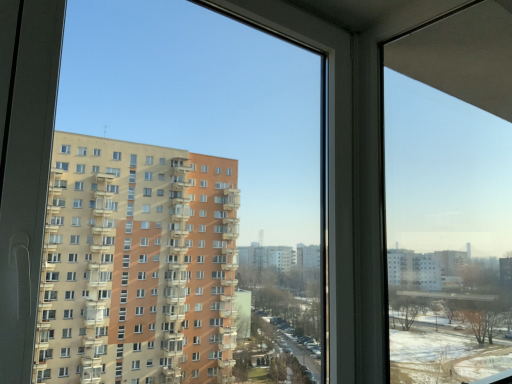
Describe the element at coordinates (450, 197) in the screenshot. Image resolution: width=512 pixels, height=384 pixels. I see `transparent glass window at center` at that location.

Where is `transparent glass window at center`? The image size is (512, 384). transparent glass window at center is located at coordinates (450, 197).

Image resolution: width=512 pixels, height=384 pixels. I want to click on transparent glass window at center, so click(450, 197).